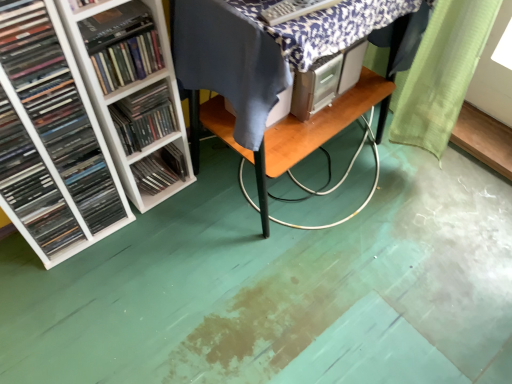
Question: Should I look upward or downward to see hardcover book at left?

Choices:
 (A) up
 (B) down

Answer: (A)

Question: Is white plastic shelves at left, which is counted as the second book, starting from the left, at the right side of hardcover book at left?

Choices:
 (A) yes
 (B) no

Answer: (B)

Question: Can you confirm if white plastic shelves at left, which is the 2th book in right-to-left order, is smaller than hardcover book at left?

Choices:
 (A) yes
 (B) no

Answer: (B)

Question: Is white plastic shelves at left, which is counted as the second book, starting from the left, not close to hardcover book at left?

Choices:
 (A) no
 (B) yes

Answer: (A)

Question: From a real-world perspective, is white plastic shelves at left, which is counted as the second book, starting from the left, positioned under hardcover book at left based on gravity?

Choices:
 (A) no
 (B) yes

Answer: (B)

Question: Considering the relative sizes of white plastic shelves at left, which is counted as the second book, starting from the left, and hardcover book at left in the image provided, is white plastic shelves at left, which is counted as the second book, starting from the left, wider than hardcover book at left?

Choices:
 (A) yes
 (B) no

Answer: (A)

Question: Is white plastic shelves at left, which is counted as the second book, starting from the left, bigger than hardcover book at left?

Choices:
 (A) no
 (B) yes

Answer: (B)

Question: From a real-world perspective, is white plastic shelf at left, positioned as the 2th shelf in back-to-front order, physically above wooden table at center?

Choices:
 (A) no
 (B) yes

Answer: (B)

Question: Can you confirm if white plastic shelf at left, positioned as the 2th shelf in back-to-front order, is wider than wooden table at center?

Choices:
 (A) no
 (B) yes

Answer: (A)

Question: Does white plastic shelf at left, the first shelf positioned from the front, have a larger size compared to wooden table at center?

Choices:
 (A) no
 (B) yes

Answer: (B)

Question: Can you confirm if white plastic shelf at left, positioned as the 2th shelf in back-to-front order, is positioned to the right of wooden table at center?

Choices:
 (A) yes
 (B) no

Answer: (B)

Question: Would you say white plastic shelf at left, positioned as the 2th shelf in back-to-front order, is outside wooden table at center?

Choices:
 (A) no
 (B) yes

Answer: (B)

Question: Would you say white plastic shelf at left, positioned as the 2th shelf in back-to-front order, contains wooden table at center?

Choices:
 (A) yes
 (B) no

Answer: (B)

Question: Would you say white plastic shelf at left, marked as the 1th book in a right-to-left arrangement, is part of wooden table at center's contents?

Choices:
 (A) no
 (B) yes

Answer: (A)